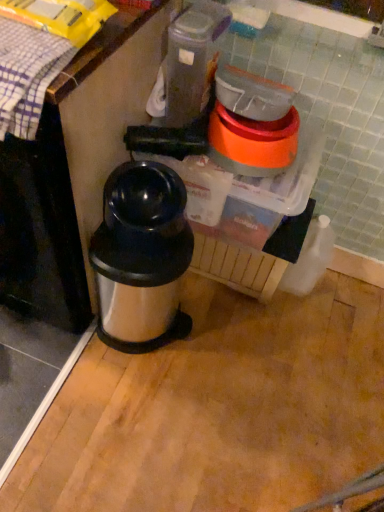
The width and height of the screenshot is (384, 512). I want to click on free point to the left of silver metallic thermos at center, so click(49, 340).